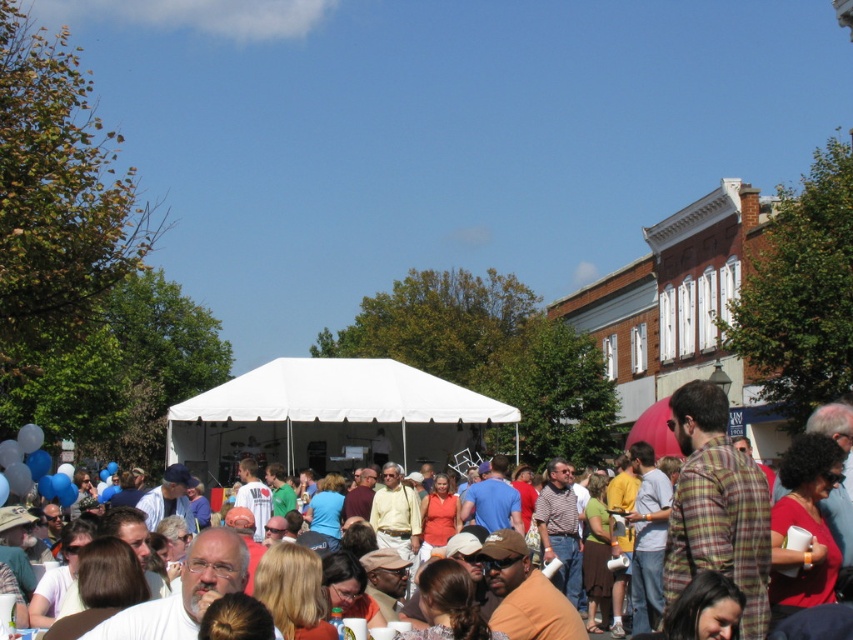
Between white fabric canopy at center and white tent at center, which one appears on the left side from the viewer's perspective?

white fabric canopy at center is more to the left.

Does white fabric canopy at center appear under white tent at center?

No, white fabric canopy at center is not below white tent at center.

Is point (260, 435) more distant than point (695, 476)?

Yes, it is.

What are the coordinates of `white fabric canopy at center` in the screenshot? It's located at (328, 417).